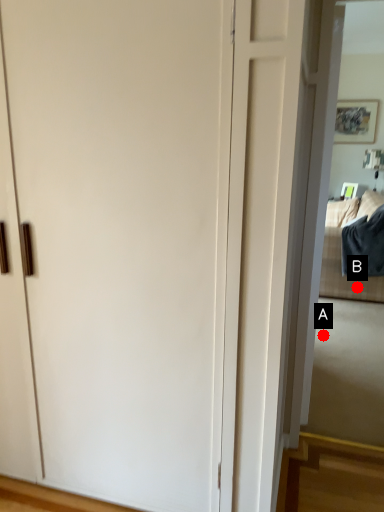
Question: Two points are circled on the image, labeled by A and B beside each circle. Which point is further to the camera?

Choices:
 (A) A is further
 (B) B is further

Answer: (B)